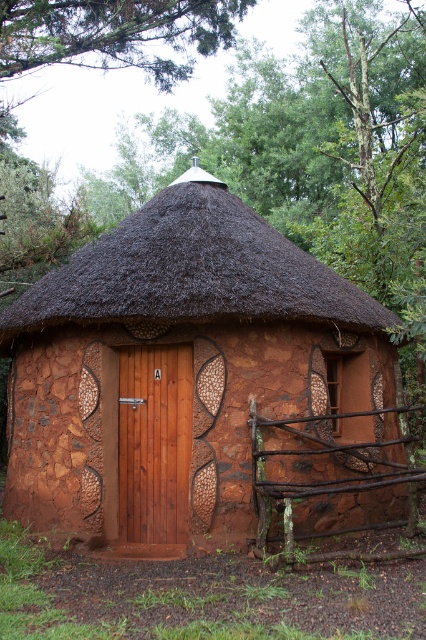
You are standing in front of the rustic round hut and notice a specific point marked at coordinates point (192,269). Based on the scene description, what object or material is located at this point?

The point (192,269) corresponds to the brown thatch at center, which is part of the conical thatched roof made from dark, tightly packed straw or reeds.

You are an architect designing a new ecofriendly building and want to incorporate elements from this rustic hut. If you want to use both the brown thatch at center and the brown wooden fence at lower right in your design, which element should you make larger to stay true to the original scene?

The brown thatch at center should be made larger than the brown wooden fence at lower right to stay true to the original scene since the brown thatch at center has a larger size compared to brown wooden fence at lower right in the image.